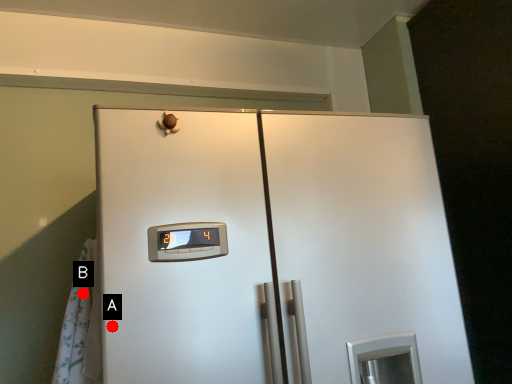
Question: Two points are circled on the image, labeled by A and B beside each circle. Which of the following is the closest to the observer?

Choices:
 (A) A is closer
 (B) B is closer

Answer: (A)